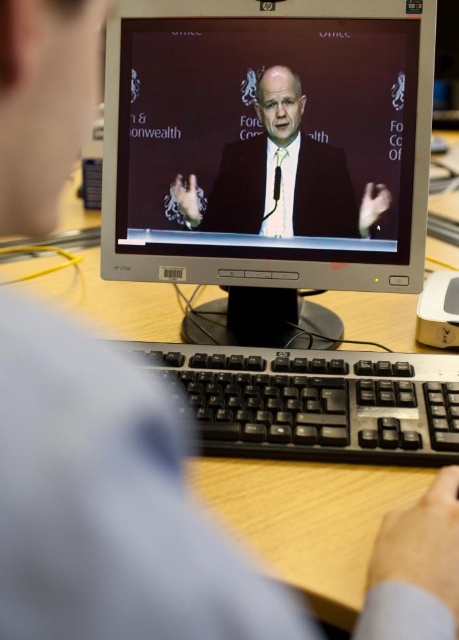
Does white plastic monitor at center have a lesser height compared to satin black suit at center?

No, white plastic monitor at center is not shorter than satin black suit at center.

I want to click on white plastic monitor at center, so click(x=268, y=154).

Who is positioned more to the left, white plastic monitor at center or black plastic keyboard at center?

white plastic monitor at center

Which is behind, point (375, 282) or point (419, 448)?

The point (375, 282) is behind.

Does point (197, 12) come behind point (419, 355)?

Yes, point (197, 12) is farther from viewer.

The width and height of the screenshot is (459, 640). I want to click on white plastic monitor at center, so click(x=268, y=154).

Who is more distant from viewer, (425, 435) or (290, 220)?

The point (290, 220) is behind.

Is black plastic keyboard at center thinner than satin black suit at center?

Incorrect, black plastic keyboard at center's width is not less than satin black suit at center's.

Between point (239, 388) and point (283, 93), which one is positioned in front?

Point (239, 388)

Identify the location of black plastic keyboard at center. The height and width of the screenshot is (640, 459). (317, 403).